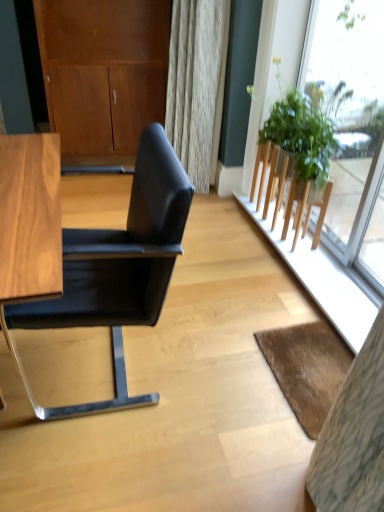
Question: Is transparent glass window at upper right smaller than black leather chair at left?

Choices:
 (A) yes
 (B) no

Answer: (A)

Question: From a real-world perspective, is transparent glass window at upper right positioned under black leather chair at left based on gravity?

Choices:
 (A) no
 (B) yes

Answer: (A)

Question: Is transparent glass window at upper right at the left side of black leather chair at left?

Choices:
 (A) no
 (B) yes

Answer: (A)

Question: From the image's perspective, would you say transparent glass window at upper right is shown under black leather chair at left?

Choices:
 (A) no
 (B) yes

Answer: (A)

Question: Is transparent glass window at upper right beside black leather chair at left?

Choices:
 (A) yes
 (B) no

Answer: (B)

Question: Does transparent glass window at upper right have a larger size compared to black leather chair at left?

Choices:
 (A) yes
 (B) no

Answer: (B)

Question: Is the surface of transparent glass window at upper right in direct contact with brown textured mat at lower right?

Choices:
 (A) no
 (B) yes

Answer: (A)

Question: From the image's perspective, would you say transparent glass window at upper right is shown under brown textured mat at lower right?

Choices:
 (A) no
 (B) yes

Answer: (A)

Question: Does transparent glass window at upper right lie in front of brown textured mat at lower right?

Choices:
 (A) yes
 (B) no

Answer: (B)

Question: From a real-world perspective, is transparent glass window at upper right located beneath brown textured mat at lower right?

Choices:
 (A) yes
 (B) no

Answer: (B)

Question: Could you tell me if transparent glass window at upper right is turned towards brown textured mat at lower right?

Choices:
 (A) yes
 (B) no

Answer: (B)

Question: Is transparent glass window at upper right taller than brown textured mat at lower right?

Choices:
 (A) yes
 (B) no

Answer: (A)

Question: Would you say brown textured mat at lower right is outside green leafy plant at right?

Choices:
 (A) no
 (B) yes

Answer: (B)